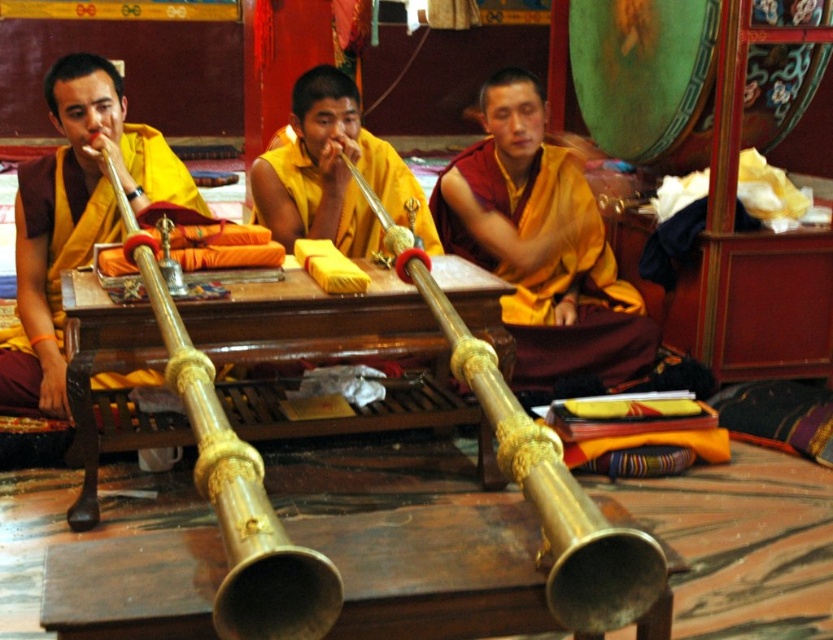
You are a visitor standing in front of the wooden table holding the folded fabrics. You want to place a small offering between the matte gold horn at left and the yellow silk monk at center. Can you fit it there?

The matte gold horn at left and yellow silk monk at center are 24.86 inches apart, so yes, you can fit a small offering between them since the space is sufficient.

You are a musician who needs to choose between the matte gold horn at left and the gold polished horn at center for a performance. If you want the wider horn, which one should you pick?

The matte gold horn at left has a larger width than the gold polished horn at center, so you should pick the matte gold horn at left for a wider option.

You are a photographer trying to capture a closeup of the matte gold horn at left without including the yellow silk monk at center in the frame. Based on their positions, is this possible?

The matte gold horn at left is below the yellow silk monk at center, so positioning the camera to capture the horn without the monk would be challenging as the monk is above it, likely blocking the view.